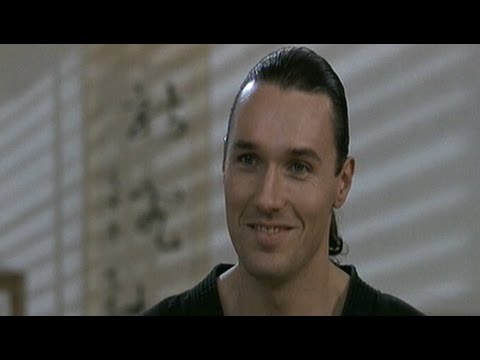
The image size is (480, 360). In order to click on wall in this screenshot , I will do `click(383, 118)`.